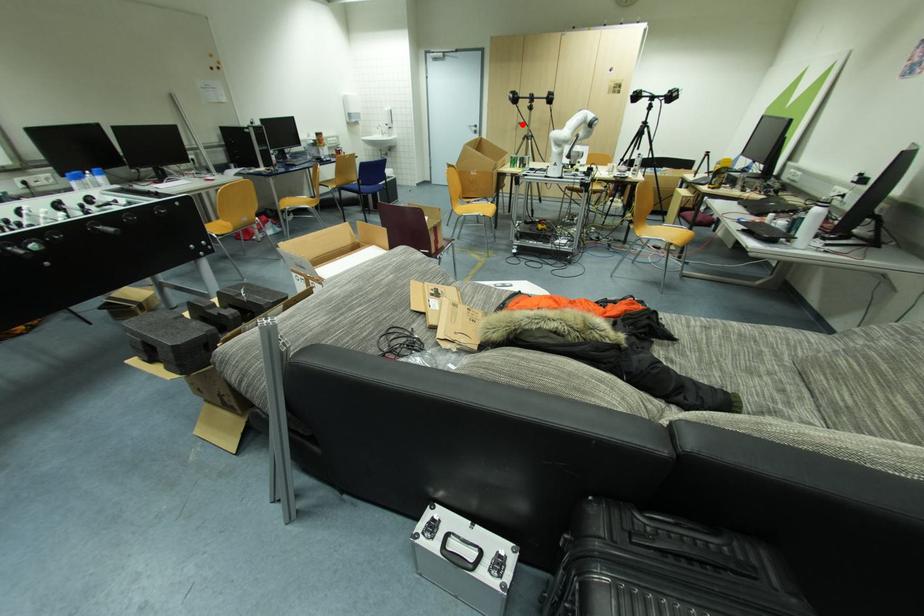
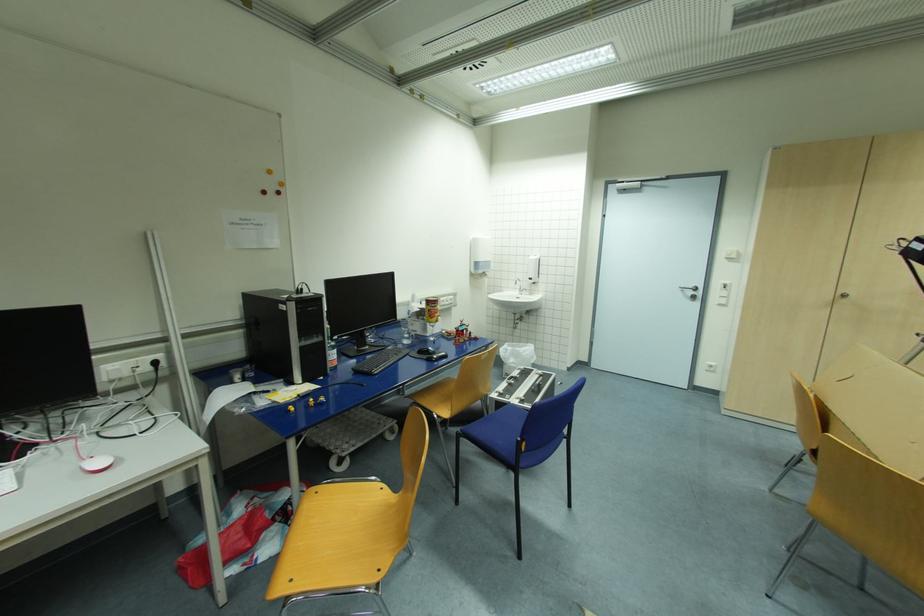
Question: A red point is marked in image1. In image2, is the corresponding 3D point closer to the camera or farther? Reply with the corresponding letter.

Choices:
 (A) The corresponding 3D point is closer.
 (B) The corresponding 3D point is farther.

Answer: (B)